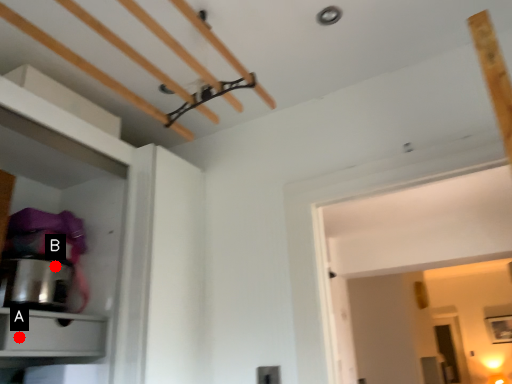
Question: Two points are circled on the image, labeled by A and B beside each circle. Which of the following is the closest to the observer?

Choices:
 (A) A is closer
 (B) B is closer

Answer: (A)